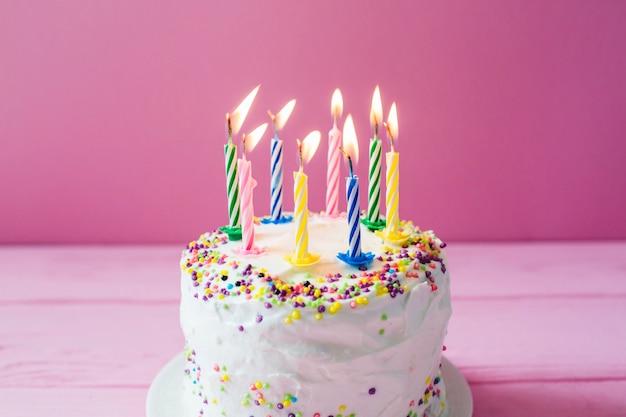
At what (x,y) coordinates should I click in order to perform the action: click on candle wicks. Please return your answer as a coordinate pair (x, y). Looking at the image, I should click on (228, 126), (245, 141), (272, 117), (298, 147), (334, 112), (350, 166), (376, 125), (387, 134).